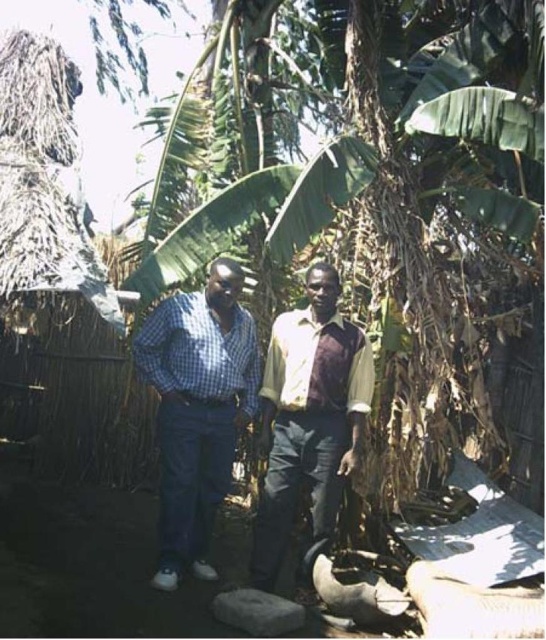
Where is the checkered fabric shirt at center located in the image?

The checkered fabric shirt at center is located at point (198, 408).

You are trying to determine the vertical arrangement of the two people in the image. The checkered fabric shirt at center and the light brown fabric shirt at center are both visible. Which shirt is positioned higher up?

The checkered fabric shirt at center is located above the light brown fabric shirt at center, so it is positioned higher up.